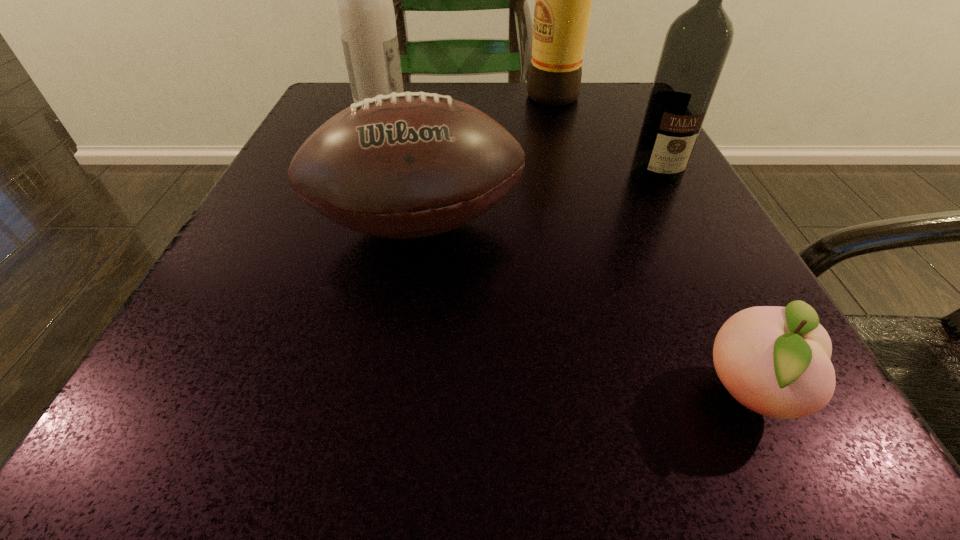
Find the location of a particular element. The width and height of the screenshot is (960, 540). the second alcohol from right to left is located at coordinates (563, 0).

Where is `the leftmost alcohol`? The image size is (960, 540). the leftmost alcohol is located at coordinates (364, 7).

Where is `the nearest alcohol`? the nearest alcohol is located at coordinates (697, 43).

This screenshot has width=960, height=540. What are the coordinates of `the fourth tallest object` in the screenshot? It's located at (404, 165).

Find the location of a particular element. The height and width of the screenshot is (540, 960). the shortest object is located at coordinates (774, 360).

What are the coordinates of `the nearest object` in the screenshot? It's located at (774, 360).

Where is `free region located on the label of the third object from right to left`? free region located on the label of the third object from right to left is located at coordinates (444, 96).

The width and height of the screenshot is (960, 540). In order to click on free space located on the label of the third object from right to left in this screenshot , I will do click(348, 96).

Identify the location of free region located on the label of the third object from right to left. (406, 96).

The width and height of the screenshot is (960, 540). What are the coordinates of `free space located on the label of the leftmost alcohol` in the screenshot? It's located at click(x=566, y=107).